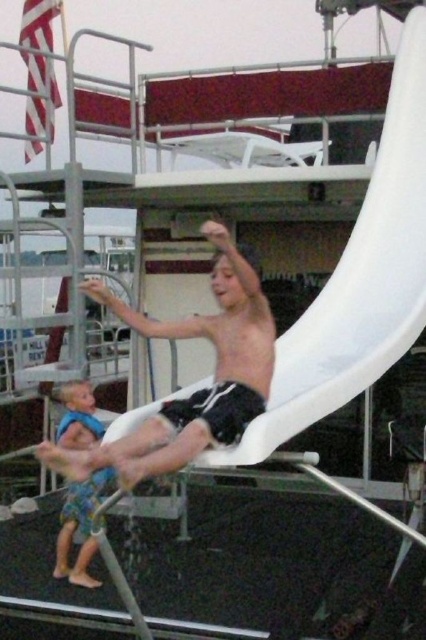
Which is in front, point (236, 452) or point (80, 284)?

Positioned in front is point (236, 452).

Looking at this image, measure the distance between white plastic slide at center and camera.

They are 3.57 meters apart.

Identify the location of white plastic slide at center. This screenshot has height=640, width=426. (359, 280).

Is point (241, 429) closer to viewer compared to point (95, 500)?

Yes, it is in front of point (95, 500).

Who is more forward, (236, 406) or (92, 422)?

Point (236, 406) is more forward.

What are the coordinates of `smooth white slide at center` in the screenshot? It's located at (199, 388).

Locate an element on the screen. The width and height of the screenshot is (426, 640). smooth white slide at center is located at coordinates (199, 388).

Who is lower down, white plastic slide at center or blue fabric swimsuit at lower left?

blue fabric swimsuit at lower left

Which is behind, point (423, 177) or point (58, 564)?

The point (423, 177) is behind.

Is point (339, 300) in front of point (88, 435)?

Yes, point (339, 300) is in front of point (88, 435).

Identify the location of white plastic slide at center. (359, 280).